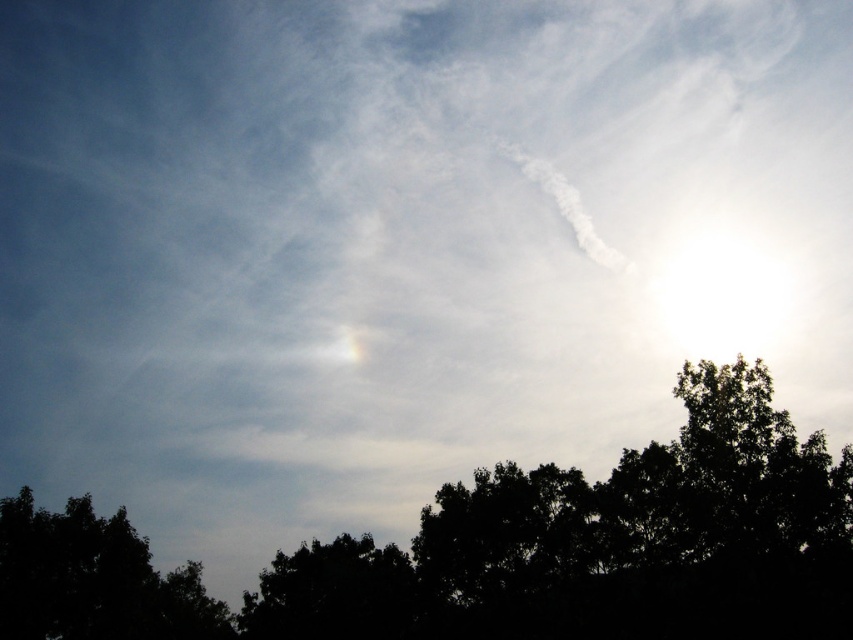
Which is behind, point (612, 538) or point (51, 634)?

The point (51, 634) is more distant.

You are a GUI agent. You are given a task and a screenshot of the screen. Output one action in this format:
    pyautogui.click(x=<x>, y=<y>)
    Task: Click on the black leafy tree at lower center
    Image resolution: width=853 pixels, height=640 pixels.
    Given the screenshot: What is the action you would take?
    pyautogui.click(x=503, y=550)